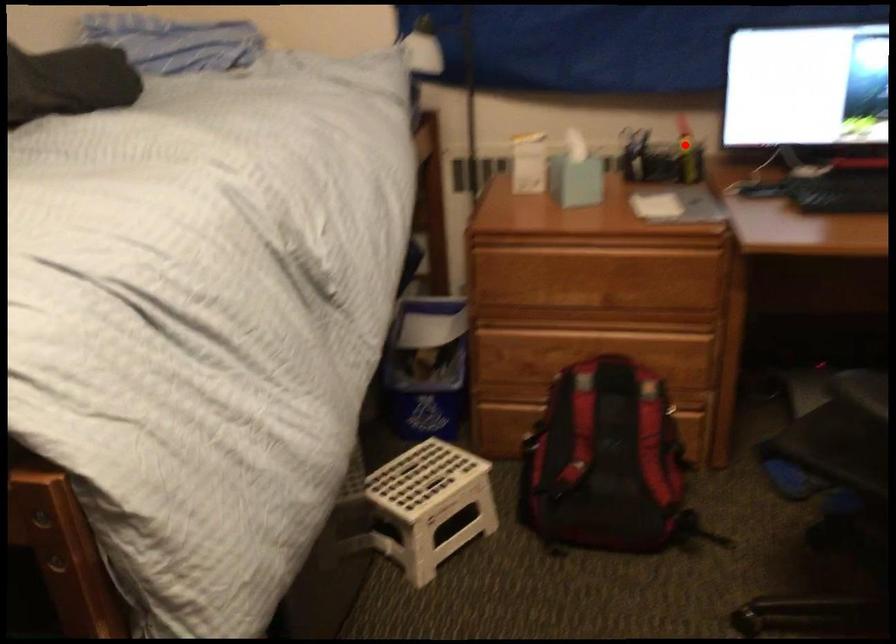
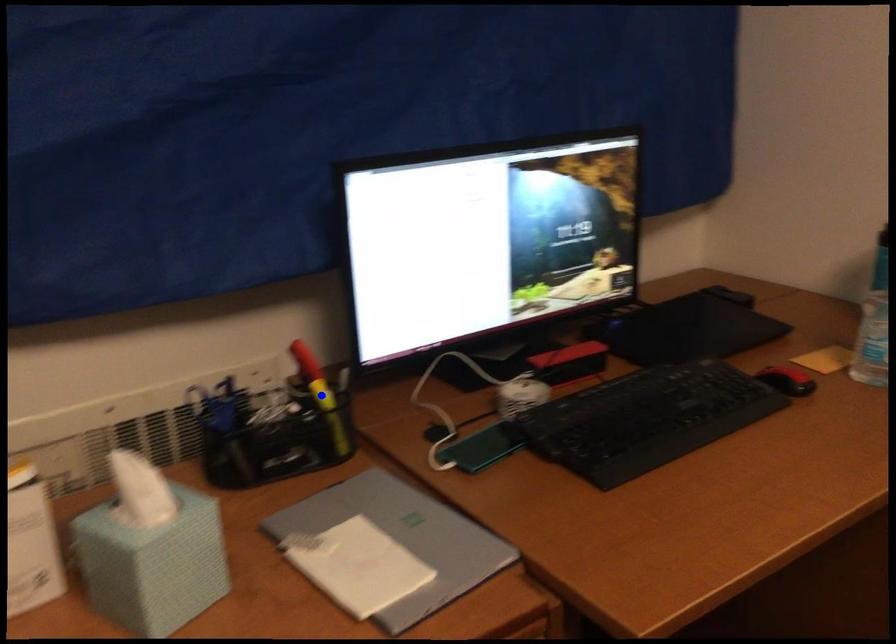
Question: I am providing you with two images of the same scene from different viewpoints. A red point is marked on the first image. You are given multiple points on the second image. Which point in image 2 represents the same 3d spot as the red point in image 1?

Choices:
 (A) yellow point
 (B) green point
 (C) blue point

Answer: (C)